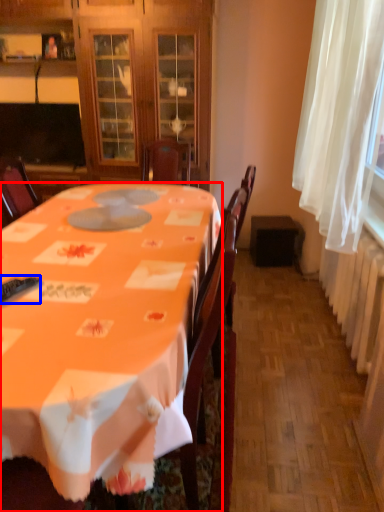
Question: Which of the following is the farthest to the observer, desk (highlighted by a red box) or remote control (highlighted by a blue box)?

Choices:
 (A) desk
 (B) remote control

Answer: (B)